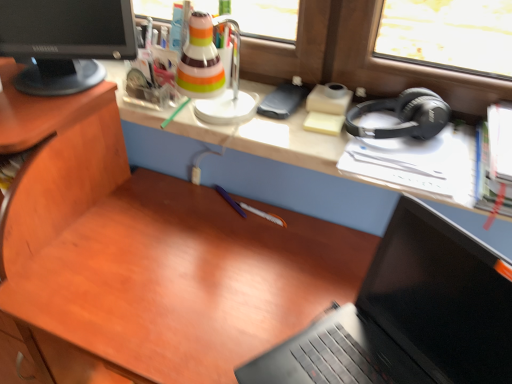
Question: Should I look upward or downward to see black matte laptop at lower right?

Choices:
 (A) up
 (B) down

Answer: (B)

Question: Is black matte laptop at lower right at the left side of black glossy computer monitor at upper left?

Choices:
 (A) no
 (B) yes

Answer: (A)

Question: Is black matte laptop at lower right positioned in front of black glossy computer monitor at upper left?

Choices:
 (A) no
 (B) yes

Answer: (B)

Question: Does black matte laptop at lower right have a lesser height compared to black glossy computer monitor at upper left?

Choices:
 (A) no
 (B) yes

Answer: (A)

Question: From a real-world perspective, is black matte laptop at lower right located beneath black glossy computer monitor at upper left?

Choices:
 (A) no
 (B) yes

Answer: (B)

Question: From the image's perspective, is black matte laptop at lower right located beneath black glossy computer monitor at upper left?

Choices:
 (A) no
 (B) yes

Answer: (B)

Question: Does black matte laptop at lower right have a larger size compared to black glossy computer monitor at upper left?

Choices:
 (A) no
 (B) yes

Answer: (B)

Question: From a real-world perspective, is black matte headphones at right on black glossy computer monitor at upper left?

Choices:
 (A) no
 (B) yes

Answer: (A)

Question: Is black matte headphones at right directly adjacent to black glossy computer monitor at upper left?

Choices:
 (A) no
 (B) yes

Answer: (A)

Question: Is black matte headphones at right outside black glossy computer monitor at upper left?

Choices:
 (A) yes
 (B) no

Answer: (A)

Question: Can you confirm if black matte headphones at right is positioned to the right of black glossy computer monitor at upper left?

Choices:
 (A) yes
 (B) no

Answer: (A)

Question: Can you confirm if black matte headphones at right is shorter than black glossy computer monitor at upper left?

Choices:
 (A) no
 (B) yes

Answer: (B)

Question: From the image's perspective, is black matte headphones at right on black glossy computer monitor at upper left?

Choices:
 (A) no
 (B) yes

Answer: (A)

Question: Does black matte laptop at lower right have a lesser width compared to black matte headphones at right?

Choices:
 (A) no
 (B) yes

Answer: (A)